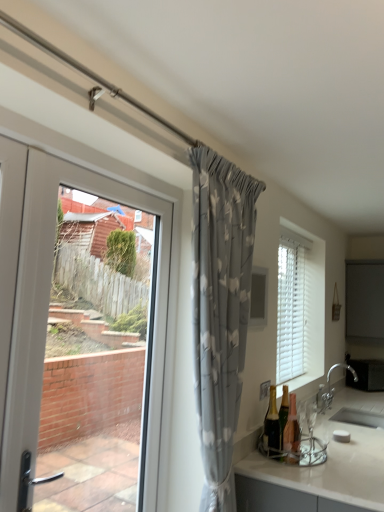
The image size is (384, 512). What do you see at coordinates (272, 423) in the screenshot? I see `shiny gold bottle at lower right, which ranks as the 1th bottle in left-to-right order` at bounding box center [272, 423].

This screenshot has width=384, height=512. In order to click on gray floral fabric curtain at center in this screenshot , I will do `click(220, 310)`.

This screenshot has height=512, width=384. I want to click on clear glass window screen at upper center, so click(259, 297).

What is the approximate width of white plastic door at left?

4.17 inches.

Find the location of `shiny gold bottle at lower right, which ranks as the 1th bottle in left-to-right order`. shiny gold bottle at lower right, which ranks as the 1th bottle in left-to-right order is located at coordinates (272, 423).

Does point (204, 247) lie behind point (380, 433)?

No, (204, 247) is in front of (380, 433).

You are a GUI agent. You are given a task and a screenshot of the screen. Output one action in this format:
    pyautogui.click(x=<x>, y=<y>)
    Task: Click on the countertop below the gray floral fabric curtain at center (from a real-world perspective)
    The width and height of the screenshot is (384, 512).
    Given the screenshot: What is the action you would take?
    coord(317,477)

From a real-world perspective, who is located lower, gray floral fabric curtain at center or white glossy countertop at lower right?

white glossy countertop at lower right is physically lower.

What's the angular difference between white wood blinds at right and white glossy countertop at lower right's facing directions?

The angular difference between white wood blinds at right and white glossy countertop at lower right is 0.395 degrees.

Considering the points (291, 359) and (359, 498), which point is in front, point (291, 359) or point (359, 498)?

The point (359, 498) is in front.

Is white wood blinds at right next to white glossy countertop at lower right and touching it?

white wood blinds at right and white glossy countertop at lower right are clearly separated.

Considering the sizes of objects white wood blinds at right and white glossy countertop at lower right in the image provided, who is thinner, white wood blinds at right or white glossy countertop at lower right?

white wood blinds at right.

Considering the relative positions of white glossy countertop at lower right and gray floral fabric curtain at center in the image provided, is white glossy countertop at lower right to the left or to the right of gray floral fabric curtain at center?

white glossy countertop at lower right is to the right of gray floral fabric curtain at center.

Would you say white glossy countertop at lower right is inside or outside gray floral fabric curtain at center?

white glossy countertop at lower right is spatially situated outside gray floral fabric curtain at center.

Does white glossy countertop at lower right have a larger size compared to gray floral fabric curtain at center?

Yes.

Who is taller, white glossy countertop at lower right or gray floral fabric curtain at center?

With more height is gray floral fabric curtain at center.

Consider the image. Is white wood blinds at right far away from clear glass window screen at upper center?

Yes, white wood blinds at right is far from clear glass window screen at upper center.

Between white wood blinds at right and clear glass window screen at upper center, which one has smaller size?

clear glass window screen at upper center is smaller.

Can you confirm if white plastic door at left is thinner than silver metallic faucet at lower right?

No.

Between white plastic door at left and silver metallic faucet at lower right, which one has more height?

With more height is white plastic door at left.

Which is behind, white plastic door at left or silver metallic faucet at lower right?

silver metallic faucet at lower right is more distant.

This screenshot has width=384, height=512. Find the location of `door above the silver metallic faucet at lower right (from the image's perspective)`. door above the silver metallic faucet at lower right (from the image's perspective) is located at coordinates (47, 313).

How many degrees apart are the facing directions of silver metallic faucet at lower right and shiny gold bottle at lower right, which ranks as the 1th bottle in left-to-right order?

1.08 degrees.

Measure the distance between silver metallic faucet at lower right and shiny gold bottle at lower right, acting as the second bottle starting from the right.

silver metallic faucet at lower right and shiny gold bottle at lower right, acting as the second bottle starting from the right, are 1.06 meters apart.

Who is taller, silver metallic faucet at lower right or shiny gold bottle at lower right, which ranks as the 1th bottle in left-to-right order?

With more height is silver metallic faucet at lower right.

Is silver metallic faucet at lower right at the right side of shiny gold bottle at lower right, acting as the second bottle starting from the right?

Yes, silver metallic faucet at lower right is to the right of shiny gold bottle at lower right, acting as the second bottle starting from the right.

From the picture: Is white plastic door at left further to the viewer compared to white wood blinds at right?

No, the depth of white plastic door at left is less than that of white wood blinds at right.

Which is farther from the camera, (13, 333) or (319, 369)?

The point (319, 369) is farther from the camera.

This screenshot has height=512, width=384. Find the location of `door directly beneath the white wood blinds at right (from a real-world perspective)`. door directly beneath the white wood blinds at right (from a real-world perspective) is located at coordinates (47, 313).

At what (x,y) coordinates should I click in order to perform the action: click on countertop below the gray floral fabric curtain at center (from the image's perspective). Please return your answer as a coordinate pair (x, y). Image resolution: width=384 pixels, height=512 pixels. Looking at the image, I should click on (317, 477).

I want to click on countertop below the white wood blinds at right (from a real-world perspective), so click(x=317, y=477).

Estimate the real-world distances between objects in this image. Which object is further from clear glass window screen at upper center, silver metallic faucet at lower right or gray floral fabric curtain at center?

Based on the image, silver metallic faucet at lower right appears to be further to clear glass window screen at upper center.

Considering their positions, is gray floral fabric curtain at center positioned closer to matte glass bottle at lower right, which is the 2th bottle in left-to-right order, than shiny gold bottle at lower right, acting as the second bottle starting from the right?

→ shiny gold bottle at lower right, acting as the second bottle starting from the right, lies closer to matte glass bottle at lower right, which is the 2th bottle in left-to-right order, than the other object.

Estimate the real-world distances between objects in this image. Which object is further from matte glass bottle at lower right, marked as the first bottle in a right-to-left arrangement, white plastic door at left or silver metallic faucet at lower right?

white plastic door at left is positioned further to the anchor matte glass bottle at lower right, marked as the first bottle in a right-to-left arrangement.

Looking at the image, which one is located further to matte glass bottle at lower right, which is the 2th bottle in left-to-right order, gray floral fabric curtain at center or white plastic door at left?

white plastic door at left is further to matte glass bottle at lower right, which is the 2th bottle in left-to-right order.

Considering their positions, is matte glass bottle at lower right, which is the 2th bottle in left-to-right order, positioned further to shiny gold bottle at lower right, which ranks as the 1th bottle in left-to-right order, than gray floral fabric curtain at center?

gray floral fabric curtain at center is positioned further to the anchor shiny gold bottle at lower right, which ranks as the 1th bottle in left-to-right order.

Looking at the image, which one is located closer to silver metallic faucet at lower right, gray floral fabric curtain at center or white wood blinds at right?

Based on the image, white wood blinds at right appears to be nearer to silver metallic faucet at lower right.

From the image, which object appears to be nearer to clear glass window screen at upper center, gray floral fabric curtain at center or white glossy countertop at lower right?

gray floral fabric curtain at center is closer to clear glass window screen at upper center.

From the image, which object appears to be farther from shiny gold bottle at lower right, acting as the second bottle starting from the right, matte glass bottle at lower right, which is the 2th bottle in left-to-right order, or white plastic door at left?

white plastic door at left is further to shiny gold bottle at lower right, acting as the second bottle starting from the right.

The height and width of the screenshot is (512, 384). Identify the location of countertop between matte glass bottle at lower right, marked as the first bottle in a right-to-left arrangement, and silver metallic faucet at lower right in the front-back direction. (317, 477).

Where is `curtain between white plastic door at left and silver metallic faucet at lower right in the front-back direction`? curtain between white plastic door at left and silver metallic faucet at lower right in the front-back direction is located at coordinates (220, 310).

This screenshot has height=512, width=384. I want to click on curtain positioned between white plastic door at left and clear glass window screen at upper center from near to far, so click(x=220, y=310).

Where is `bottle located between gray floral fabric curtain at center and shiny gold bottle at lower right, acting as the second bottle starting from the right, in the depth direction`? This screenshot has height=512, width=384. bottle located between gray floral fabric curtain at center and shiny gold bottle at lower right, acting as the second bottle starting from the right, in the depth direction is located at coordinates (292, 432).